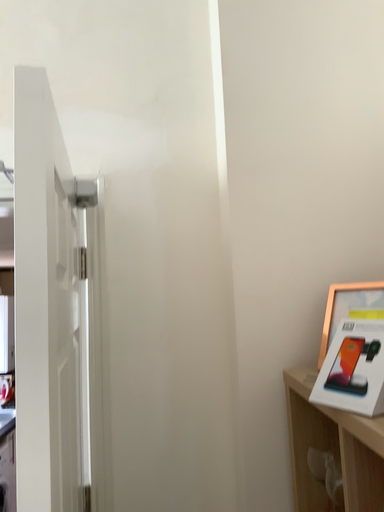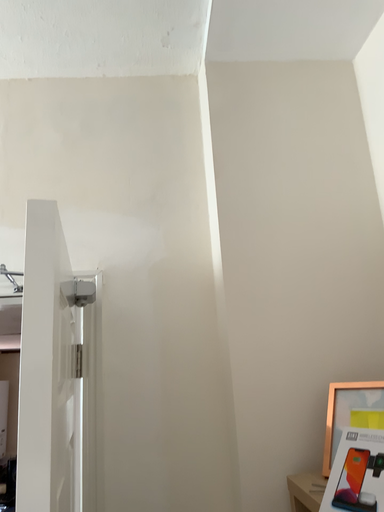
Question: How did the camera likely rotate when shooting the video?

Choices:
 (A) rotated downward
 (B) rotated upward

Answer: (B)